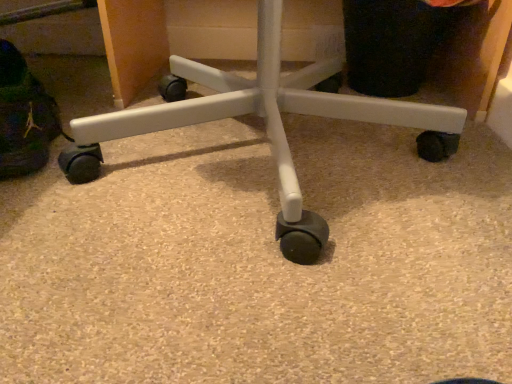
What do you see at coordinates (266, 123) in the screenshot? I see `matte plastic chair leg at center` at bounding box center [266, 123].

Where is `matte plastic chair leg at center`? The height and width of the screenshot is (384, 512). matte plastic chair leg at center is located at coordinates (266, 123).

Where is `matte plastic chair leg at center`? The width and height of the screenshot is (512, 384). matte plastic chair leg at center is located at coordinates (266, 123).